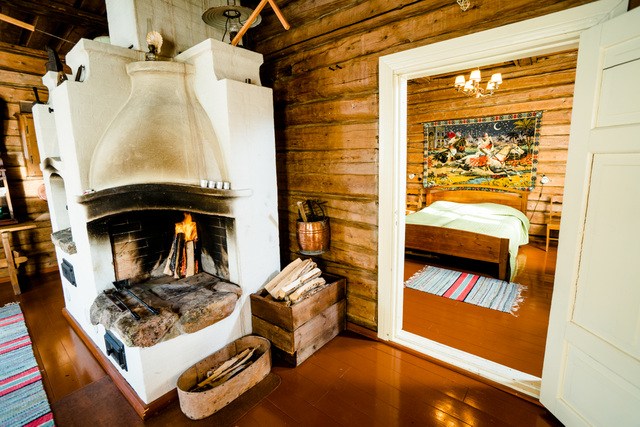
Where is `chandelier`? The height and width of the screenshot is (427, 640). chandelier is located at coordinates (475, 78).